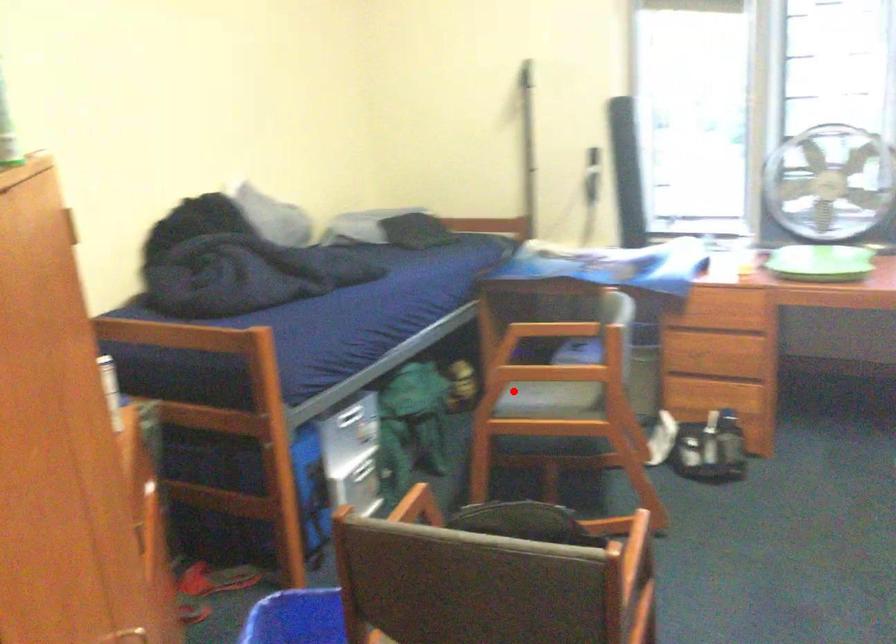
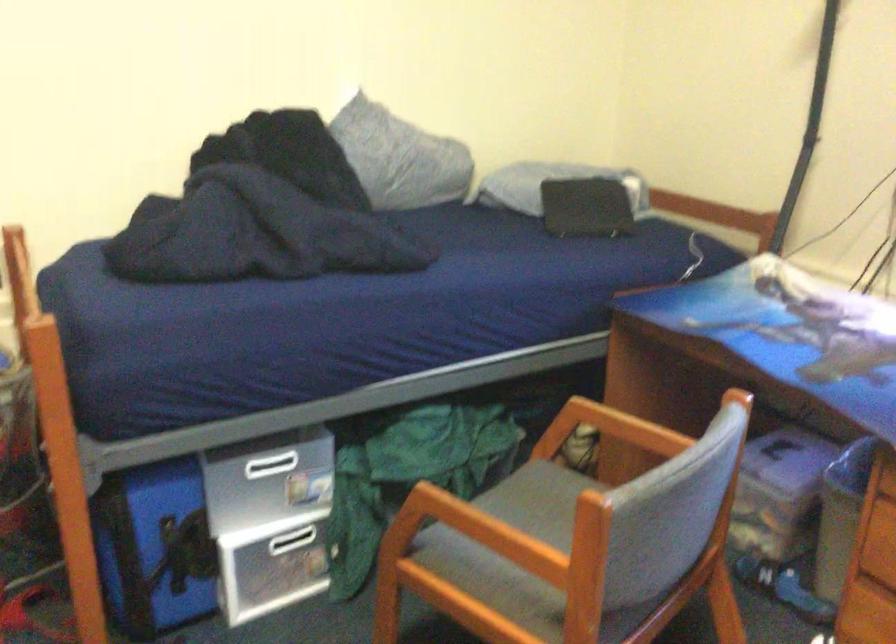
Question: I am providing you with two images of the same scene from different viewpoints. A red point is shown in image1. For the corresponding object point in image2, is it positioned nearer or farther from the camera?

Choices:
 (A) Nearer
 (B) Farther

Answer: (A)